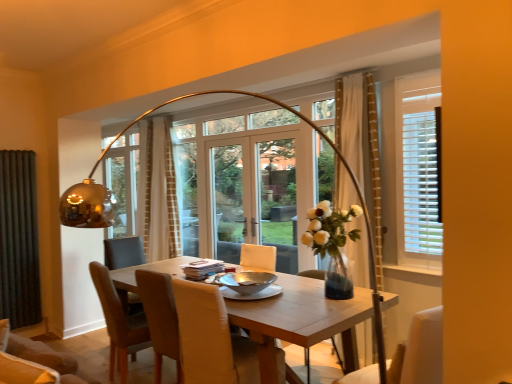
Question: Which direction should I rotate to look at beige textured curtain at center, which is the 2th curtain in right-to-left order?

Choices:
 (A) left
 (B) right

Answer: (A)

Question: Would you say beige textured curtain at center, which is the 2th curtain in right-to-left order, contains leather at center, acting as the second chair starting from the front?

Choices:
 (A) no
 (B) yes

Answer: (A)

Question: Is beige textured curtain at center, the 2th curtain from the left, oriented towards leather at center, which is the 2th chair from back to front?

Choices:
 (A) no
 (B) yes

Answer: (A)

Question: Is beige textured curtain at center, which is the 2th curtain in right-to-left order, to the right of leather at center, which is the 2th chair from back to front, from the viewer's perspective?

Choices:
 (A) no
 (B) yes

Answer: (A)

Question: Considering the relative sizes of beige textured curtain at center, the first curtain when ordered from back to front, and leather at center, acting as the second chair starting from the front, in the image provided, is beige textured curtain at center, the first curtain when ordered from back to front, bigger than leather at center, acting as the second chair starting from the front,?

Choices:
 (A) no
 (B) yes

Answer: (B)

Question: From a real-world perspective, is beige textured curtain at center, the 2th curtain from the left, on top of leather at center, acting as the 2th chair starting from the right?

Choices:
 (A) no
 (B) yes

Answer: (B)

Question: Is beige textured curtain at center, the first curtain when ordered from back to front, behind leather at center, acting as the second chair starting from the left?

Choices:
 (A) yes
 (B) no

Answer: (A)

Question: Is black fabric curtain at left, which is counted as the third curtain, starting from the right, oriented away from white fabric chair at lower right, which is the 1th chair from right to left?

Choices:
 (A) no
 (B) yes

Answer: (A)

Question: From a real-world perspective, is black fabric curtain at left, which is counted as the third curtain, starting from the right, on top of white fabric chair at lower right, the 1th chair when ordered from front to back?

Choices:
 (A) yes
 (B) no

Answer: (A)

Question: Is black fabric curtain at left, marked as the 2th curtain in a front-to-back arrangement, far away from white fabric chair at lower right, which is the third chair in back-to-front order?

Choices:
 (A) no
 (B) yes

Answer: (B)

Question: Is black fabric curtain at left, which is counted as the third curtain, starting from the right, at the right side of white fabric chair at lower right, which is the 1th chair from right to left?

Choices:
 (A) yes
 (B) no

Answer: (B)

Question: Is black fabric curtain at left, which is counted as the third curtain, starting from the right, aimed at white fabric chair at lower right, which is the third chair in back-to-front order?

Choices:
 (A) yes
 (B) no

Answer: (B)

Question: Is the depth of black fabric curtain at left, which is the 1th curtain in left-to-right order, less than that of white fabric chair at lower right, which is the 1th chair from right to left?

Choices:
 (A) yes
 (B) no

Answer: (B)

Question: Is light brown wooden table at center inside black fabric curtain at left, marked as the 2th curtain in a front-to-back arrangement?

Choices:
 (A) yes
 (B) no

Answer: (B)